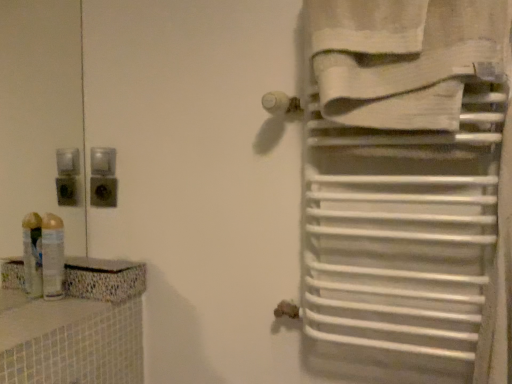
Question: Should I look upward or downward to see black plastic outlet at upper left?

Choices:
 (A) down
 (B) up

Answer: (A)

Question: Is the position of black plastic outlet at upper left less distant than that of translucent plastic spray can at left?

Choices:
 (A) yes
 (B) no

Answer: (B)

Question: Considering the relative sizes of black plastic outlet at upper left and translucent plastic spray can at left in the image provided, is black plastic outlet at upper left bigger than translucent plastic spray can at left?

Choices:
 (A) yes
 (B) no

Answer: (B)

Question: Is black plastic outlet at upper left completely or partially outside of translucent plastic spray can at left?

Choices:
 (A) no
 (B) yes

Answer: (B)

Question: Is translucent plastic spray can at left completely or partially inside black plastic outlet at upper left?

Choices:
 (A) yes
 (B) no

Answer: (B)

Question: Would you say black plastic outlet at upper left is a long distance from translucent plastic spray can at left?

Choices:
 (A) yes
 (B) no

Answer: (B)

Question: Is black plastic outlet at upper left taller than translucent plastic spray can at left?

Choices:
 (A) yes
 (B) no

Answer: (B)

Question: Considering the relative sizes of translucent plastic spray can at left and black plastic outlet at upper left in the image provided, is translucent plastic spray can at left shorter than black plastic outlet at upper left?

Choices:
 (A) yes
 (B) no

Answer: (B)

Question: Is translucent plastic spray can at left at the left side of black plastic outlet at upper left?

Choices:
 (A) yes
 (B) no

Answer: (A)

Question: Considering the relative sizes of translucent plastic spray can at left and black plastic outlet at upper left in the image provided, is translucent plastic spray can at left taller than black plastic outlet at upper left?

Choices:
 (A) yes
 (B) no

Answer: (A)

Question: Is translucent plastic spray can at left outside of black plastic outlet at upper left?

Choices:
 (A) no
 (B) yes

Answer: (B)

Question: Is translucent plastic spray can at left in front of black plastic outlet at upper left?

Choices:
 (A) no
 (B) yes

Answer: (B)

Question: Is translucent plastic spray can at left further to the viewer compared to black plastic outlet at upper left?

Choices:
 (A) no
 (B) yes

Answer: (A)

Question: Does white cotton towel at upper right lie behind translucent plastic spray can at left?

Choices:
 (A) no
 (B) yes

Answer: (A)